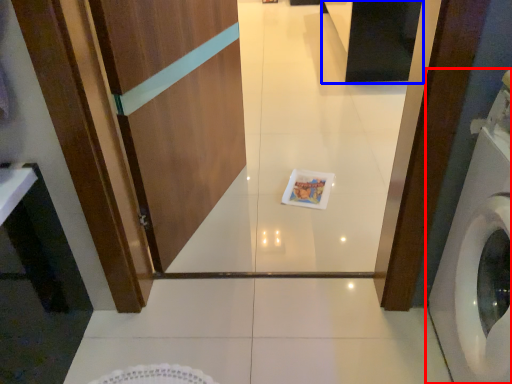
Question: Which point is closer to the camera, washing machine (highlighted by a red box) or cabinetry (highlighted by a blue box)?

Choices:
 (A) washing machine
 (B) cabinetry

Answer: (A)